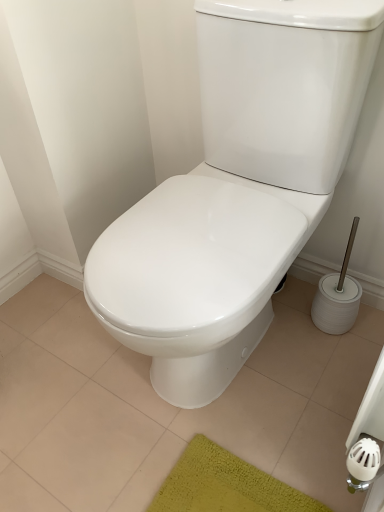
Question: Should I look upward or downward to see white glossy toilet at center?

Choices:
 (A) down
 (B) up

Answer: (A)

Question: Can you confirm if white glossy toilet at center is thinner than white glossy toilet at center?

Choices:
 (A) no
 (B) yes

Answer: (A)

Question: Are white glossy toilet at center and white glossy toilet at center located far from each other?

Choices:
 (A) no
 (B) yes

Answer: (A)

Question: Does white glossy toilet at center lie in front of white glossy toilet at center?

Choices:
 (A) yes
 (B) no

Answer: (B)

Question: Does white glossy toilet at center have a larger size compared to white glossy toilet at center?

Choices:
 (A) yes
 (B) no

Answer: (B)

Question: From the image's perspective, would you say white glossy toilet at center is shown under white glossy toilet at center?

Choices:
 (A) yes
 (B) no

Answer: (A)

Question: Is white glossy toilet at center behind white glossy toilet at center?

Choices:
 (A) no
 (B) yes

Answer: (B)

Question: Can you confirm if white glossy toilet at center is thinner than white glossy toilet at center?

Choices:
 (A) yes
 (B) no

Answer: (A)

Question: Considering the relative positions of white glossy toilet at center and white glossy toilet at center in the image provided, is white glossy toilet at center to the right of white glossy toilet at center from the viewer's perspective?

Choices:
 (A) yes
 (B) no

Answer: (A)

Question: From the image's perspective, is white glossy toilet at center beneath white glossy toilet at center?

Choices:
 (A) yes
 (B) no

Answer: (B)

Question: Is white glossy toilet at center located outside white glossy toilet at center?

Choices:
 (A) no
 (B) yes

Answer: (B)

Question: Would you say white glossy toilet at center contains white glossy toilet at center?

Choices:
 (A) no
 (B) yes

Answer: (A)

Question: From the image's perspective, would you say white glossy toilet at center is positioned over white glossy toilet at center?

Choices:
 (A) no
 (B) yes

Answer: (B)

Question: Is white glossy toilet at center bigger or smaller than white glossy toilet at center?

Choices:
 (A) small
 (B) big

Answer: (A)